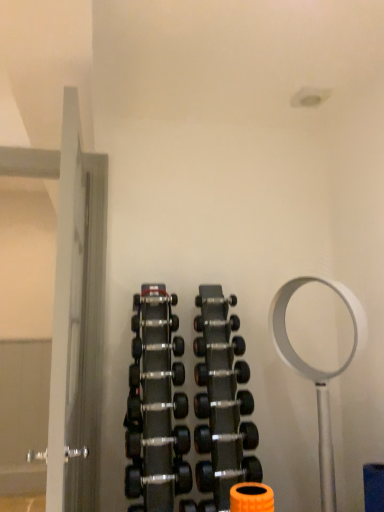
I want to click on black rubber dumbbell at center, the 10th dumbbell viewed from the top, so click(x=158, y=479).

What do you see at coordinates (157, 374) in the screenshot? This screenshot has height=512, width=384. I see `black rubber dumbbell at center, the 8th dumbbell from the bottom` at bounding box center [157, 374].

Describe the element at coordinates (221, 373) in the screenshot. I see `black rubber dumbbell at center, marked as the 7th dumbbell in a bottom-to-top arrangement` at that location.

The image size is (384, 512). Describe the element at coordinates (158, 441) in the screenshot. I see `black rubber dumbbell at center, arranged as the 4th dumbbell when ordered from the bottom` at that location.

Describe the element at coordinates (158, 347) in the screenshot. I see `black rubber dumbbell at center, the tenth dumbbell positioned from the bottom` at that location.

The image size is (384, 512). What do you see at coordinates (157, 407) in the screenshot? I see `black rubber dumbbell at center, which is the sixth dumbbell in top-to-bottom order` at bounding box center [157, 407].

Where is `polished silver dumbbell at center, the 11th dumbbell ordered from the bottom`? polished silver dumbbell at center, the 11th dumbbell ordered from the bottom is located at coordinates click(216, 323).

From the image's perspective, which one is positioned lower, black rubber dumbbell at center, which is the fifth dumbbell in top-to-bottom order, or black rubber dumbbell at center, positioned as the second dumbbell in top-to-bottom order?

black rubber dumbbell at center, which is the fifth dumbbell in top-to-bottom order, is shown below in the image.

Which of these two, black rubber dumbbell at center, which is the fifth dumbbell in top-to-bottom order, or black rubber dumbbell at center, positioned as the second dumbbell in top-to-bottom order, stands shorter?

black rubber dumbbell at center, positioned as the second dumbbell in top-to-bottom order, is shorter.

Would you say black rubber dumbbell at center, which is the fifth dumbbell in top-to-bottom order, is outside black rubber dumbbell at center, positioned as the second dumbbell in top-to-bottom order?

Yes, black rubber dumbbell at center, which is the fifth dumbbell in top-to-bottom order, is located beyond the bounds of black rubber dumbbell at center, positioned as the second dumbbell in top-to-bottom order.

Can you confirm if black rubber dumbbell at center, which is the fifth dumbbell in top-to-bottom order, is positioned to the right of black rubber dumbbell at center, the tenth dumbbell positioned from the bottom?

Yes, black rubber dumbbell at center, which is the fifth dumbbell in top-to-bottom order, is to the right of black rubber dumbbell at center, the tenth dumbbell positioned from the bottom.

How distant is white glossy door at left from black rubber dumbbell at center, acting as the 5th dumbbell starting from the bottom?

white glossy door at left and black rubber dumbbell at center, acting as the 5th dumbbell starting from the bottom, are 80.20 centimeters apart from each other.

Considering their positions, is white glossy door at left located in front of or behind black rubber dumbbell at center, acting as the 5th dumbbell starting from the bottom?

white glossy door at left is in front of black rubber dumbbell at center, acting as the 5th dumbbell starting from the bottom.

Could you tell me if white glossy door at left is turned towards black rubber dumbbell at center, arranged as the 7th dumbbell when viewed from the top?

Yes, white glossy door at left is turned towards black rubber dumbbell at center, arranged as the 7th dumbbell when viewed from the top.

Considering the relative sizes of white glossy door at left and black rubber dumbbell at center, arranged as the 7th dumbbell when viewed from the top, in the image provided, is white glossy door at left taller than black rubber dumbbell at center, arranged as the 7th dumbbell when viewed from the top,?

Correct, white glossy door at left is much taller as black rubber dumbbell at center, arranged as the 7th dumbbell when viewed from the top.

How many degrees apart are the facing directions of black rubber dumbbell at center, the 10th dumbbell viewed from the top, and black rubber dumbbell at center, the 11th dumbbell positioned from the top?

There is a 1.86-degree angle between the facing directions of black rubber dumbbell at center, the 10th dumbbell viewed from the top, and black rubber dumbbell at center, the 11th dumbbell positioned from the top.

Is the position of black rubber dumbbell at center, the 2th dumbbell from the bottom, less distant than that of black rubber dumbbell at center, the 1th dumbbell ordered from the bottom?

That is True.

In the image, there is a black rubber dumbbell at center, the 1th dumbbell ordered from the bottom. At what (x,y) coordinates should I click in order to perform the action: click on dumbbell below it (from a real-world perspective). Please return your answer as a coordinate pair (x, y). Image resolution: width=384 pixels, height=512 pixels. Looking at the image, I should click on (158, 479).

From the image's perspective, is black rubber dumbbell at center, arranged as the 7th dumbbell when viewed from the top, located beneath white glossy door at left?

Yes, from the image's perspective, black rubber dumbbell at center, arranged as the 7th dumbbell when viewed from the top, is beneath white glossy door at left.

Find the location of `door on the left of black rubber dumbbell at center, arranged as the 7th dumbbell when viewed from the top`. door on the left of black rubber dumbbell at center, arranged as the 7th dumbbell when viewed from the top is located at coordinates (68, 321).

Is black rubber dumbbell at center, acting as the 5th dumbbell starting from the bottom, facing towards white glossy door at left?

No, black rubber dumbbell at center, acting as the 5th dumbbell starting from the bottom, is not aimed at white glossy door at left.

Between black rubber dumbbell at center, arranged as the 7th dumbbell when viewed from the top, and white glossy door at left, which one has smaller width?

Thinner between the two is black rubber dumbbell at center, arranged as the 7th dumbbell when viewed from the top.

From the image's perspective, count 5th dumbbells upward from the black rubber dumbbell at center, marked as the eighth dumbbell in a top-to-bottom arrangement, and point to it. Please provide its 2D coordinates.

[(206, 346)]

Is black rubber dumbbell at center, arranged as the 4th dumbbell when ordered from the bottom, beside black rubber dumbbell at center, the ninth dumbbell from the bottom?

They are not placed beside each other.

Consider the image. Can black rubber dumbbell at center, the 3th dumbbell in the top-to-bottom sequence, be found inside black rubber dumbbell at center, arranged as the 4th dumbbell when ordered from the bottom?

That's incorrect, black rubber dumbbell at center, the 3th dumbbell in the top-to-bottom sequence, is not inside black rubber dumbbell at center, arranged as the 4th dumbbell when ordered from the bottom.

Based on the photo, in terms of height, does black rubber dumbbell at center, marked as the eighth dumbbell in a top-to-bottom arrangement, look taller or shorter compared to black rubber dumbbell at center, the ninth dumbbell from the bottom?

Considering their sizes, black rubber dumbbell at center, marked as the eighth dumbbell in a top-to-bottom arrangement, has more height than black rubber dumbbell at center, the ninth dumbbell from the bottom.

Measure the distance from black rubber dumbbell at center, arranged as the 4th dumbbell when ordered from the bottom, to black rubber dumbbell at center, the 1th dumbbell ordered from the bottom.

The distance of black rubber dumbbell at center, arranged as the 4th dumbbell when ordered from the bottom, from black rubber dumbbell at center, the 1th dumbbell ordered from the bottom, is 8.86 inches.

From the image's perspective, is black rubber dumbbell at center, arranged as the 4th dumbbell when ordered from the bottom, on top of black rubber dumbbell at center, the 1th dumbbell ordered from the bottom?

Yes, from the image's perspective, black rubber dumbbell at center, arranged as the 4th dumbbell when ordered from the bottom, is above black rubber dumbbell at center, the 1th dumbbell ordered from the bottom.

Considering the relative sizes of black rubber dumbbell at center, arranged as the 4th dumbbell when ordered from the bottom, and black rubber dumbbell at center, the 1th dumbbell ordered from the bottom, in the image provided, is black rubber dumbbell at center, arranged as the 4th dumbbell when ordered from the bottom, smaller than black rubber dumbbell at center, the 1th dumbbell ordered from the bottom,?

Yes.

Consider the image. Is black rubber dumbbell at center, the third dumbbell when ordered from bottom to top, in front of or behind white glossy door at left in the image?

In the image, black rubber dumbbell at center, the third dumbbell when ordered from bottom to top, appears behind white glossy door at left.

From the image's perspective, who appears lower, black rubber dumbbell at center, acting as the ninth dumbbell starting from the top, or white glossy door at left?

black rubber dumbbell at center, acting as the ninth dumbbell starting from the top, from the image's perspective.

Between black rubber dumbbell at center, acting as the ninth dumbbell starting from the top, and white glossy door at left, which one has more height?

With more height is white glossy door at left.

Find the location of `the 3rd dumbbell below the black rubber dumbbell at center, the tenth dumbbell positioned from the bottom (from a real-world perspective)`. the 3rd dumbbell below the black rubber dumbbell at center, the tenth dumbbell positioned from the bottom (from a real-world perspective) is located at coordinates (221, 373).

This screenshot has height=512, width=384. I want to click on door on the left of the black rubber dumbbell at center, arranged as the 7th dumbbell when viewed from the top, so click(x=68, y=321).

When comparing their distances from black rubber dumbbell at center, marked as the eighth dumbbell in a top-to-bottom arrangement, does black rubber dumbbell at center, the ninth dumbbell from the bottom, or black rubber dumbbell at center, the 10th dumbbell viewed from the top, seem closer?

Based on the image, black rubber dumbbell at center, the 10th dumbbell viewed from the top, appears to be nearer to black rubber dumbbell at center, marked as the eighth dumbbell in a top-to-bottom arrangement.

Looking at the image, which one is located further to black rubber dumbbell at center, arranged as the 4th dumbbell when viewed from the top, black rubber dumbbell at center, the 10th dumbbell viewed from the top, or white glossy door at left?

Among the two, white glossy door at left is located further to black rubber dumbbell at center, arranged as the 4th dumbbell when viewed from the top.

Based on the photo, from the image, which object appears to be nearer to black rubber dumbbell at center, the 10th dumbbell viewed from the top, white glossy door at left or black rubber dumbbell at center, marked as the eighth dumbbell in a top-to-bottom arrangement?

Among the two, black rubber dumbbell at center, marked as the eighth dumbbell in a top-to-bottom arrangement, is located nearer to black rubber dumbbell at center, the 10th dumbbell viewed from the top.

Looking at the image, which one is located closer to black rubber dumbbell at center, which is the fifth dumbbell in top-to-bottom order, white glossy door at left or black rubber dumbbell at center, positioned as the second dumbbell in top-to-bottom order?

Based on the image, black rubber dumbbell at center, positioned as the second dumbbell in top-to-bottom order, appears to be nearer to black rubber dumbbell at center, which is the fifth dumbbell in top-to-bottom order.

From the image, which object appears to be farther from black rubber dumbbell at center, which is the sixth dumbbell in top-to-bottom order, black rubber dumbbell at center, marked as the eighth dumbbell in a top-to-bottom arrangement, or black rubber dumbbell at center, the 2th dumbbell from the bottom?

Based on the image, black rubber dumbbell at center, the 2th dumbbell from the bottom, appears to be further to black rubber dumbbell at center, which is the sixth dumbbell in top-to-bottom order.

From the picture: Considering their positions, is black rubber dumbbell at center, the tenth dumbbell positioned from the bottom, positioned closer to black rubber dumbbell at center, marked as the sixth dumbbell in a bottom-to-top arrangement, than black rubber dumbbell at center, the ninth dumbbell from the bottom?

The object closer to black rubber dumbbell at center, marked as the sixth dumbbell in a bottom-to-top arrangement, is black rubber dumbbell at center, the tenth dumbbell positioned from the bottom.

In the scene shown: From the image, which object appears to be nearer to black rubber dumbbell at center, which is the sixth dumbbell in top-to-bottom order, black rubber dumbbell at center, the 11th dumbbell positioned from the top, or black rubber dumbbell at center, the tenth dumbbell positioned from the bottom?

The object closer to black rubber dumbbell at center, which is the sixth dumbbell in top-to-bottom order, is black rubber dumbbell at center, the tenth dumbbell positioned from the bottom.

Estimate the real-world distances between objects in this image. Which object is further from polished silver dumbbell at center, the 11th dumbbell ordered from the bottom, black rubber dumbbell at center, the tenth dumbbell positioned from the bottom, or black rubber dumbbell at center, marked as the eighth dumbbell in a top-to-bottom arrangement?

black rubber dumbbell at center, marked as the eighth dumbbell in a top-to-bottom arrangement, lies further to polished silver dumbbell at center, the 11th dumbbell ordered from the bottom, than the other object.